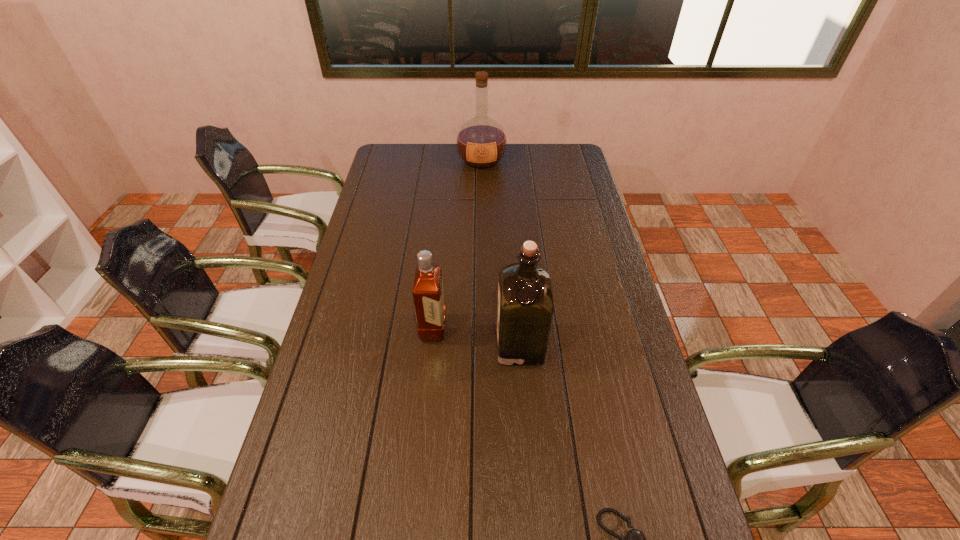
Identify the location of object that is the third closest to the farthest object. The width and height of the screenshot is (960, 540). (635, 539).

Select which object appears as the closest to the shortest liquor. Please provide its 2D coordinates. Your answer should be formatted as a tuple, i.e. [(x, y)], where the tuple contains the x and y coordinates of a point satisfying the conditions above.

[(525, 309)]

Identify which liquor is the second closest to the second shortest object. Please provide its 2D coordinates. Your answer should be formatted as a tuple, i.e. [(x, y)], where the tuple contains the x and y coordinates of a point satisfying the conditions above.

[(481, 142)]

Identify which liquor is the second closest to the farthest liquor. Please provide its 2D coordinates. Your answer should be formatted as a tuple, i.e. [(x, y)], where the tuple contains the x and y coordinates of a point satisfying the conditions above.

[(525, 309)]

This screenshot has width=960, height=540. What are the coordinates of `free space in the image that satisfies the following two spatial constraints: 1. on the front label of the farthest object; 2. on the front label of the third tallest object` in the screenshot? It's located at (482, 328).

Locate an element on the screen. The width and height of the screenshot is (960, 540). vacant space that satisfies the following two spatial constraints: 1. on the front label of the farthest liquor; 2. on the front label of the shortest liquor is located at coordinates (482, 328).